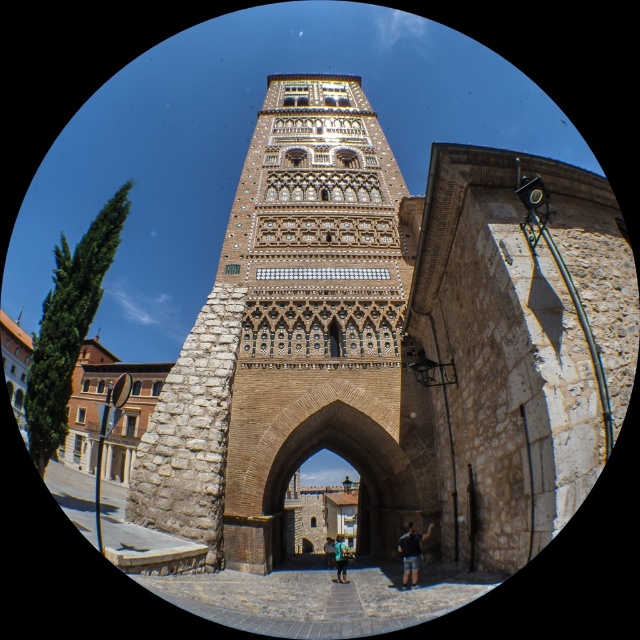
Who is lower down, brown stone bell tower at center or blue denim shorts at center?

blue denim shorts at center is lower down.

Does point (234, 387) lie in front of point (330, 536)?

Yes.

Locate an element on the screen. The width and height of the screenshot is (640, 640). brown stone bell tower at center is located at coordinates (296, 339).

What do you see at coordinates (412, 554) in the screenshot? I see `dark blue denim shorts at lower center` at bounding box center [412, 554].

Does dark blue denim shorts at lower center have a greater width compared to blue denim jeans at lower center?

Yes, dark blue denim shorts at lower center is wider than blue denim jeans at lower center.

Which is in front, point (412, 572) or point (346, 550)?

Point (412, 572) is in front.

Identify the location of dark blue denim shorts at lower center. (412, 554).

From the picture: Is dark blue denim shorts at lower center shorter than blue denim shorts at center?

Indeed, dark blue denim shorts at lower center has a lesser height compared to blue denim shorts at center.

Between dark blue denim shorts at lower center and blue denim shorts at center, which one has less height?

dark blue denim shorts at lower center

The image size is (640, 640). In order to click on dark blue denim shorts at lower center in this screenshot , I will do `click(412, 554)`.

Where is `dark blue denim shorts at lower center`? This screenshot has height=640, width=640. dark blue denim shorts at lower center is located at coordinates (412, 554).